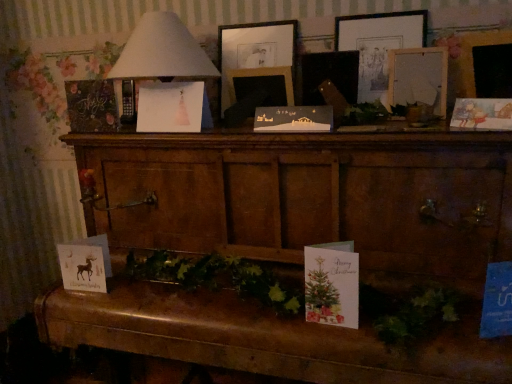
Question: Which direction should I rotate to face white paper christmas card at center, which appears as the third christmas card when ordered from the bottom, — up or down?

Choices:
 (A) down
 (B) up

Answer: (B)

Question: Is chalkboard paper at left, arranged as the 5th christmas card when ordered from the bottom, at the back of matte black picture frame at center, which is the 2th picture frame from left to right?

Choices:
 (A) yes
 (B) no

Answer: (B)

Question: From a real-world perspective, is matte black picture frame at center, which is the 2th picture frame from left to right, located beneath chalkboard paper at left, the 1th christmas card viewed from the left?

Choices:
 (A) yes
 (B) no

Answer: (B)

Question: From the image's perspective, is matte black picture frame at center, which is the 2th picture frame from left to right, on top of chalkboard paper at left, arranged as the 5th christmas card when ordered from the bottom?

Choices:
 (A) no
 (B) yes

Answer: (B)

Question: Could chalkboard paper at left, arranged as the 5th christmas card when ordered from the bottom, be considered to be inside matte black picture frame at center, which is the 2th picture frame from left to right?

Choices:
 (A) no
 (B) yes

Answer: (A)

Question: Would you say matte black picture frame at center, marked as the 3th picture frame in a right-to-left arrangement, is a long distance from chalkboard paper at left, arranged as the 5th christmas card when ordered from the bottom?

Choices:
 (A) no
 (B) yes

Answer: (A)

Question: From the image's perspective, is matte black picture frame at center, which is the 2th picture frame from left to right, below chalkboard paper at left, the fifth christmas card when ordered from right to left?

Choices:
 (A) yes
 (B) no

Answer: (B)

Question: Is matte paper card at right, the first christmas card viewed from the right, taller than pink paper christmas card at center, the 4th christmas card positioned from the bottom?

Choices:
 (A) yes
 (B) no

Answer: (B)

Question: Does matte paper card at right, the 2th christmas card from the bottom, touch pink paper christmas card at center, the 4th christmas card positioned from the bottom?

Choices:
 (A) yes
 (B) no

Answer: (B)

Question: From a real-world perspective, is matte paper card at right, the first christmas card viewed from the right, positioned under pink paper christmas card at center, acting as the 2th christmas card starting from the top, based on gravity?

Choices:
 (A) no
 (B) yes

Answer: (B)

Question: Does matte paper card at right, which ranks as the fifth christmas card in left-to-right order, lie behind pink paper christmas card at center, the 4th christmas card positioned from the bottom?

Choices:
 (A) yes
 (B) no

Answer: (B)

Question: Is matte paper card at right, the first christmas card viewed from the right, closer to the viewer compared to pink paper christmas card at center, the 4th christmas card positioned from the bottom?

Choices:
 (A) no
 (B) yes

Answer: (B)

Question: Are matte paper card at right, the first christmas card viewed from the right, and pink paper christmas card at center, the third christmas card viewed from the left, located far from each other?

Choices:
 (A) no
 (B) yes

Answer: (A)

Question: Is the depth of pink paper christmas card at center, the 4th christmas card positioned from the bottom, greater than that of matte black picture frame at center, the second picture frame when ordered from right to left?

Choices:
 (A) no
 (B) yes

Answer: (B)